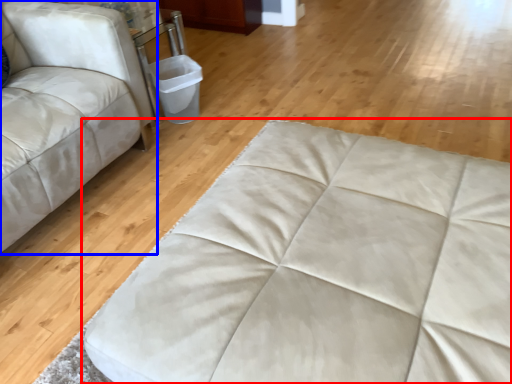
Question: Among these objects, which one is farthest to the camera, furniture (highlighted by a red box) or studio couch (highlighted by a blue box)?

Choices:
 (A) furniture
 (B) studio couch

Answer: (B)